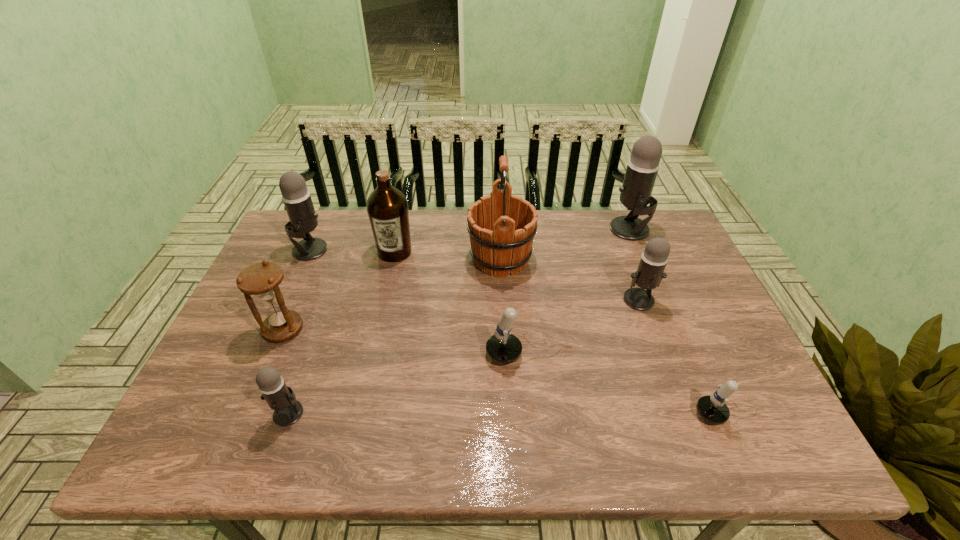
Where is `the third nearest microphone`? The image size is (960, 540). the third nearest microphone is located at coordinates (503, 347).

Locate an element on the screen. This screenshot has height=540, width=960. the nearest gray microphone is located at coordinates (279, 397).

This screenshot has width=960, height=540. Identify the location of the second gray microphone from left to right. (279, 397).

Locate an element on the screen. This screenshot has height=540, width=960. the shortest object is located at coordinates (712, 409).

Locate an element on the screen. This screenshot has width=960, height=540. the smaller white microphone is located at coordinates (712, 409).

The image size is (960, 540). I want to click on free location located 0.070m on the front of the wood wine bucket, so click(503, 301).

The height and width of the screenshot is (540, 960). I want to click on vacant space situated 0.060m on the left of the tallest microphone, so click(x=591, y=230).

Locate an element on the screen. Image resolution: width=960 pixels, height=540 pixels. vacant space located on the label of the sixth object from right to left is located at coordinates (375, 343).

Find the location of `free space located 0.120m on the back of the fifth shortest microphone`. free space located 0.120m on the back of the fifth shortest microphone is located at coordinates (324, 217).

This screenshot has width=960, height=540. In order to click on vacant area located on the front of the third farthest gray microphone in this screenshot , I will do point(694,451).